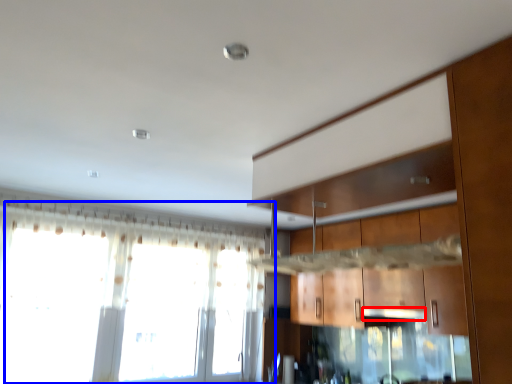
Question: Which object appears closest to the camera in this image, exhaust hood (highlighted by a red box) or window (highlighted by a blue box)?

Choices:
 (A) exhaust hood
 (B) window

Answer: (B)